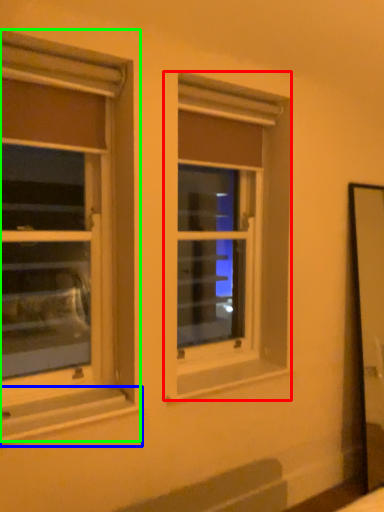
Question: Based on their relative distances, which object is nearer to window (highlighted by a red box)? Choose from window sill (highlighted by a blue box) and window (highlighted by a green box).

Choices:
 (A) window sill
 (B) window

Answer: (A)